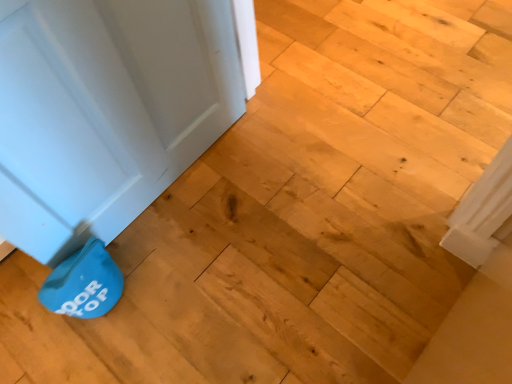
Identify the location of free space on the front side of matte blue door at lower left. (192, 285).